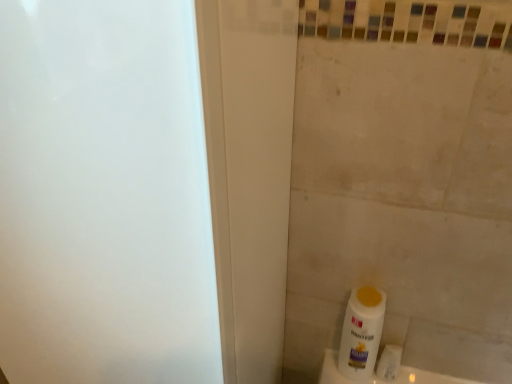
What are the coordinates of `white matte toilet paper at lower right` in the screenshot? It's located at (389, 362).

Describe the element at coordinates (389, 362) in the screenshot. I see `white matte toilet paper at lower right` at that location.

The width and height of the screenshot is (512, 384). What do you see at coordinates (361, 332) in the screenshot? I see `white plastic bottle at lower right` at bounding box center [361, 332].

You are a GUI agent. You are given a task and a screenshot of the screen. Output one action in this format:
    pyautogui.click(x=<x>, y=<y>)
    Task: Click on the white plastic bottle at lower right
    Image resolution: width=512 pixels, height=384 pixels.
    Given the screenshot: What is the action you would take?
    pyautogui.click(x=361, y=332)

I want to click on white matte toilet paper at lower right, so click(389, 362).

Considering the relative positions of white plastic bottle at lower right and white matte toilet paper at lower right in the image provided, is white plastic bottle at lower right to the right of white matte toilet paper at lower right from the viewer's perspective?

No, white plastic bottle at lower right is not to the right of white matte toilet paper at lower right.

Which object is closer to the camera, white plastic bottle at lower right or white matte toilet paper at lower right?

Positioned in front is white plastic bottle at lower right.

Is point (362, 290) less distant than point (387, 375)?

That is True.

From the image's perspective, which one is positioned lower, white plastic bottle at lower right or white matte toilet paper at lower right?

white matte toilet paper at lower right.

From a real-world perspective, relative to white matte toilet paper at lower right, is white plastic bottle at lower right vertically above or below?

In terms of real-world spatial position, white plastic bottle at lower right is above white matte toilet paper at lower right.

Can you confirm if white plastic bottle at lower right is wider than white matte toilet paper at lower right?

Correct, the width of white plastic bottle at lower right exceeds that of white matte toilet paper at lower right.

Between white plastic bottle at lower right and white matte toilet paper at lower right, which one has more height?

With more height is white plastic bottle at lower right.

Looking at this image, considering the sizes of white plastic bottle at lower right and white matte toilet paper at lower right in the image, is white plastic bottle at lower right bigger or smaller than white matte toilet paper at lower right?

In the image, white plastic bottle at lower right appears to be larger than white matte toilet paper at lower right.

Can we say white plastic bottle at lower right lies outside white matte toilet paper at lower right?

Yes, white plastic bottle at lower right is located beyond the bounds of white matte toilet paper at lower right.

Is white plastic bottle at lower right far from white matte toilet paper at lower right?

They are positioned close to each other.

Is white plastic bottle at lower right facing away from white matte toilet paper at lower right?

white plastic bottle at lower right does not have its back to white matte toilet paper at lower right.

In the image, there is a white plastic bottle at lower right. Where is `toilet paper below it (from the image's perspective)`? This screenshot has height=384, width=512. toilet paper below it (from the image's perspective) is located at coordinates (389, 362).

Consider the image. Which is more to the left, white matte toilet paper at lower right or white plastic bottle at lower right?

From the viewer's perspective, white plastic bottle at lower right appears more on the left side.

In the scene shown: Is white matte toilet paper at lower right closer to the viewer compared to white plastic bottle at lower right?

No, white matte toilet paper at lower right is further to the viewer.

Does point (401, 348) appear closer or farther from the camera than point (350, 327)?

Point (401, 348) is farther from the camera than point (350, 327).

From the image's perspective, which is above, white matte toilet paper at lower right or white plastic bottle at lower right?

white plastic bottle at lower right, from the image's perspective.

From a real-world perspective, which is physically above, white matte toilet paper at lower right or white plastic bottle at lower right?

white plastic bottle at lower right is physically above.

Does white matte toilet paper at lower right have a greater width compared to white plastic bottle at lower right?

No, white matte toilet paper at lower right is not wider than white plastic bottle at lower right.

Which of these two, white matte toilet paper at lower right or white plastic bottle at lower right, stands taller?

Standing taller between the two is white plastic bottle at lower right.

Considering the sizes of white matte toilet paper at lower right and white plastic bottle at lower right in the image, is white matte toilet paper at lower right bigger or smaller than white plastic bottle at lower right?

Considering their sizes, white matte toilet paper at lower right takes up less space than white plastic bottle at lower right.

Is white matte toilet paper at lower right not inside white plastic bottle at lower right?

Absolutely, white matte toilet paper at lower right is external to white plastic bottle at lower right.

Are white matte toilet paper at lower right and white plastic bottle at lower right beside each other?

Absolutely, white matte toilet paper at lower right is next to and touching white plastic bottle at lower right.

Could you tell me if white matte toilet paper at lower right is turned towards white plastic bottle at lower right?

No, white matte toilet paper at lower right does not turn towards white plastic bottle at lower right.

How many degrees apart are the facing directions of white matte toilet paper at lower right and white plastic bottle at lower right?

There is a 1.36-degree angle between the facing directions of white matte toilet paper at lower right and white plastic bottle at lower right.

How far apart are white matte toilet paper at lower right and white plastic bottle at lower right?

They are 9.06 centimeters apart.

I want to click on bottle in front of the white matte toilet paper at lower right, so click(x=361, y=332).

Locate an element on the screen. The image size is (512, 384). bottle that is on the left side of white matte toilet paper at lower right is located at coordinates (361, 332).

At what (x,y) coordinates should I click in order to perform the action: click on bottle above the white matte toilet paper at lower right (from the image's perspective). Please return your answer as a coordinate pair (x, y). Looking at the image, I should click on (361, 332).